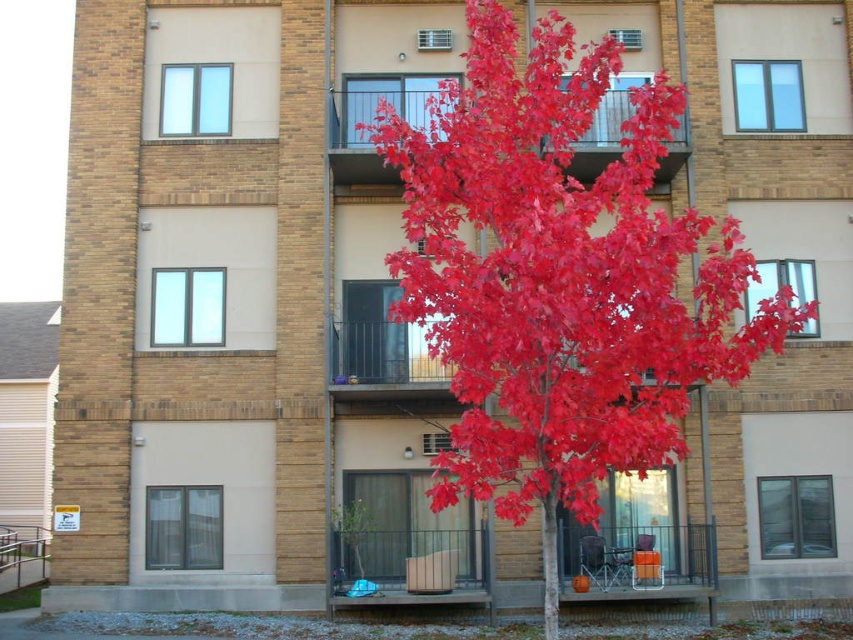
Is bright red leaves at center taller than glass railing at upper center?

No.

Between bright red leaves at center and glass railing at upper center, which one appears on the right side from the viewer's perspective?

From the viewer's perspective, bright red leaves at center appears more on the right side.

Between point (479, 209) and point (393, 172), which one is positioned behind?

Point (393, 172)

Where is `bright red leaves at center`? bright red leaves at center is located at coordinates (560, 280).